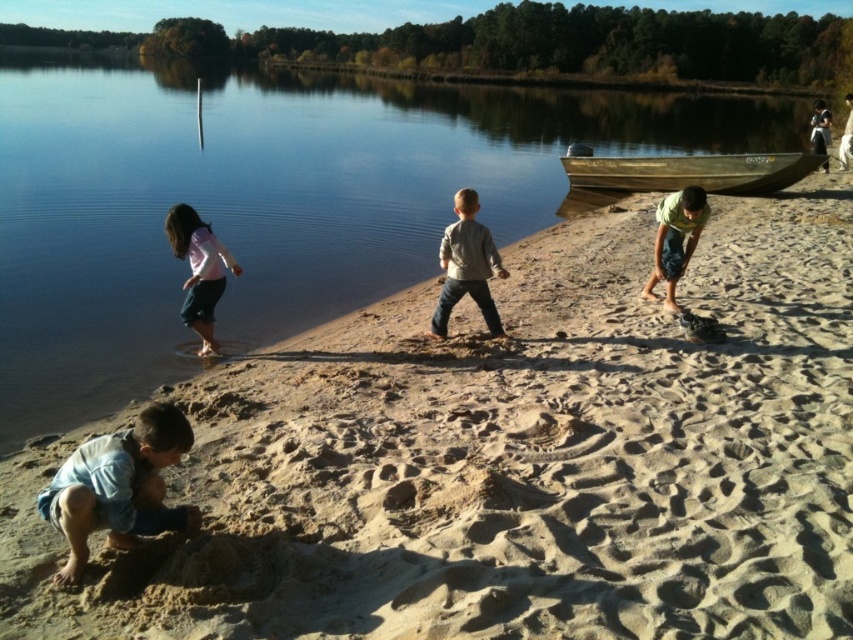
You are a parent watching your children play on the lakeside. You notice the clear water at shore left and the light gray denim jeans at center. Which object is wider in the scene?

The clear water at shore left is wider than the light gray denim jeans at center.

In the scene shown: You are a photographer standing at the lakeside. You want to take a photo that includes both the matte pink shirt at left and the light brown wooden pole at upper center. Which object will appear smaller in the final photo?

The matte pink shirt at left will appear smaller in the photo because it has a lesser height compared to the light brown wooden pole at upper center.

You are a parent watching your children play at the lakeside. You notice the clear water at shore left and the light gray denim jeans at center. Which object takes up more space in the scene?

The clear water at shore left takes up more space in the scene because it has a larger size compared to the light gray denim jeans at center.